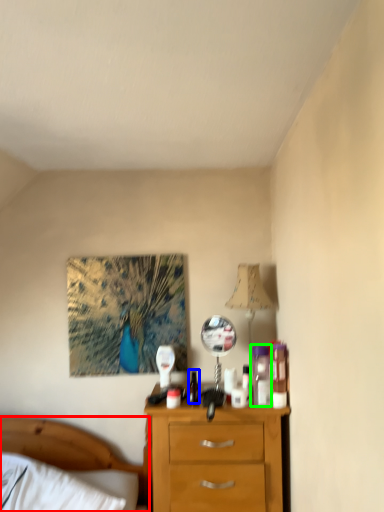
Question: Estimate the real-world distances between objects in this image. Which object is closer to bed (highlighted by a red box), bottle (highlighted by a blue box) or toiletry (highlighted by a green box)?

Choices:
 (A) bottle
 (B) toiletry

Answer: (A)